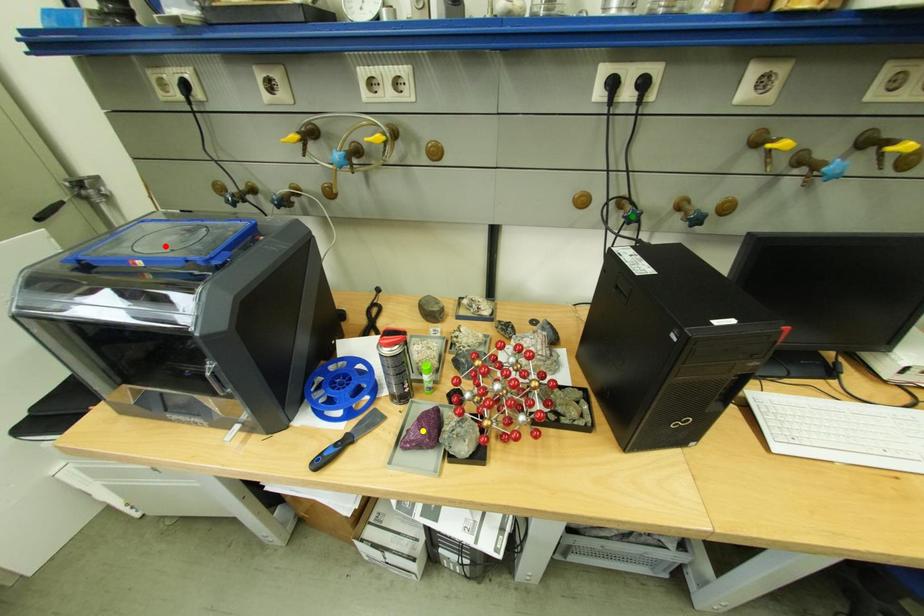
Order these from nearest to farthest:
A) green point
B) red point
C) yellow point

red point → yellow point → green point